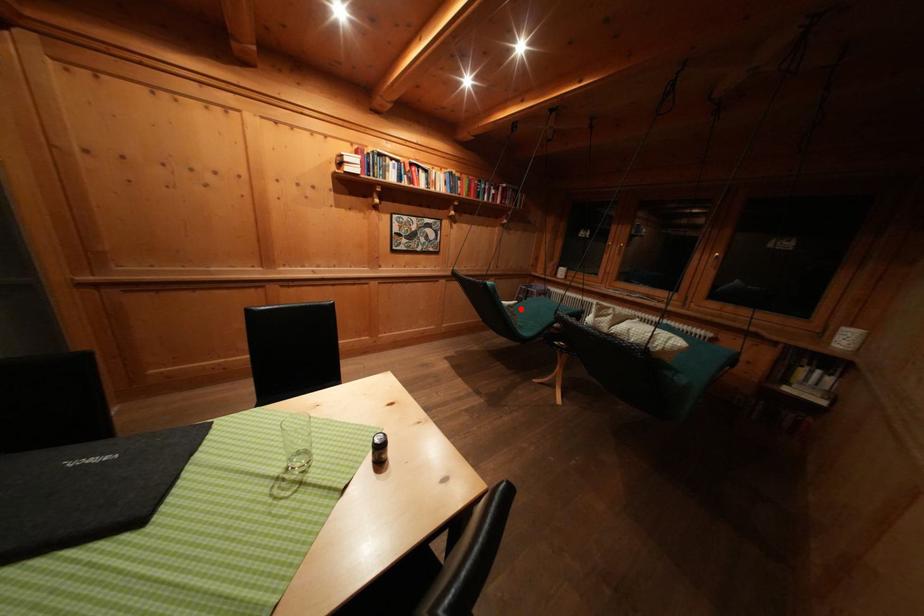
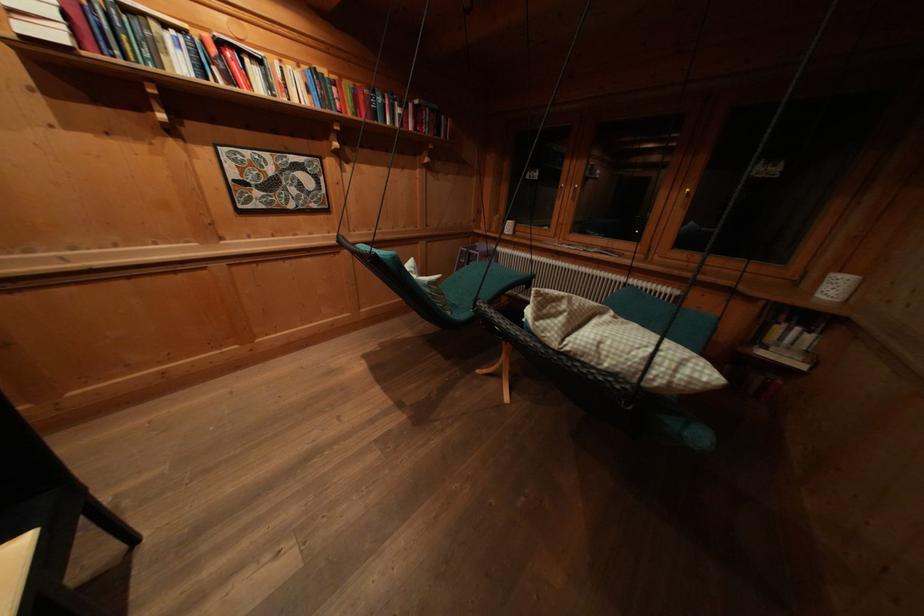
Question: I am providing you with two images of the same scene from different viewpoints. A red point is shown in image1. For the corresponding object point in image2, is it positioned nearer or farther from the camera?

Choices:
 (A) Nearer
 (B) Farther

Answer: (A)